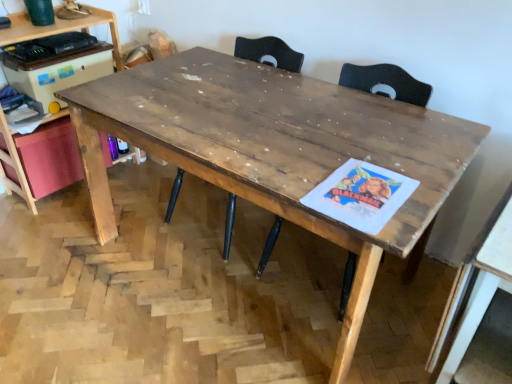
Locate an element on the screen. free location in front of wooden computer desk at left is located at coordinates (50, 230).